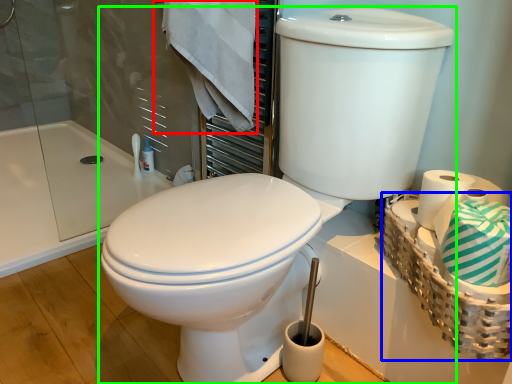
Question: Estimate the real-world distances between objects in this image. Which object is farther from bath towel (highlighted by a red box), basket (highlighted by a blue box) or toilet (highlighted by a green box)?

Choices:
 (A) basket
 (B) toilet

Answer: (A)